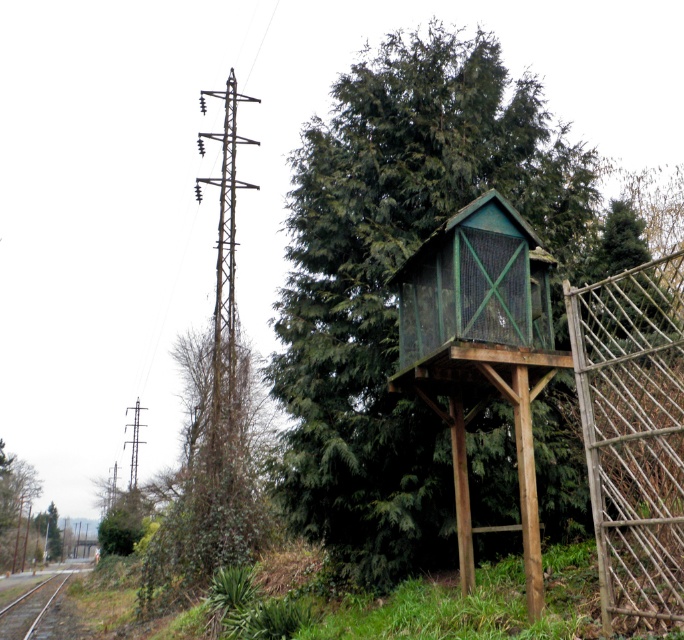
Can you confirm if green wooden birdhouse at center is positioned to the right of metallic wire at left?

Correct, you'll find green wooden birdhouse at center to the right of metallic wire at left.

Is the position of green wooden birdhouse at center less distant than that of metallic wire at left?

Yes.

Measure the distance between green wooden birdhouse at center and camera.

6.89 meters

Identify the location of green wooden birdhouse at center. This screenshot has height=640, width=684. (394, 289).

Does point (256, 99) lie in front of point (62, 616)?

No, (256, 99) is further to viewer.

Is metallic wire at left wider than smooth metal train track at lower left?

Incorrect, metallic wire at left's width does not surpass smooth metal train track at lower left's.

Image resolution: width=684 pixels, height=640 pixels. What do you see at coordinates (224, 243) in the screenshot?
I see `metallic wire at left` at bounding box center [224, 243].

You are a GUI agent. You are given a task and a screenshot of the screen. Output one action in this format:
    pyautogui.click(x=<x>, y=<y>)
    Task: Click on the metallic wire at left
    This screenshot has height=640, width=684.
    Given the screenshot: What is the action you would take?
    pyautogui.click(x=224, y=243)

Is green wooden birdhouse at center below smooth metal train track at lower left?

Actually, green wooden birdhouse at center is above smooth metal train track at lower left.

Does green wooden birdhouse at center appear over smooth metal train track at lower left?

Indeed, green wooden birdhouse at center is positioned over smooth metal train track at lower left.

Identify the location of green wooden birdhouse at center. The width and height of the screenshot is (684, 640). (394, 289).

The image size is (684, 640). I want to click on green wooden birdhouse at center, so click(x=394, y=289).